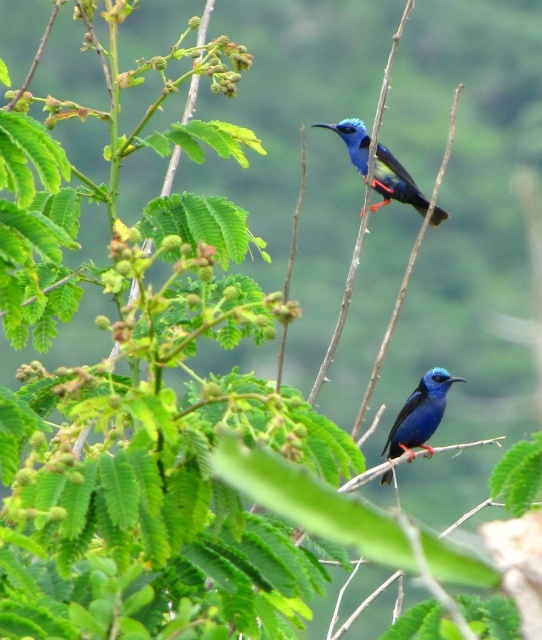
Between glossy blue hummingbird at upper center and glossy blue bird at center, which one appears on the right side from the viewer's perspective?

From the viewer's perspective, glossy blue bird at center appears more on the right side.

Who is lower down, glossy blue hummingbird at upper center or glossy blue bird at center?

glossy blue bird at center is lower down.

I want to click on glossy blue hummingbird at upper center, so click(x=395, y=182).

The height and width of the screenshot is (640, 542). Find the location of `glossy blue hummingbird at upper center`. glossy blue hummingbird at upper center is located at coordinates (395, 182).